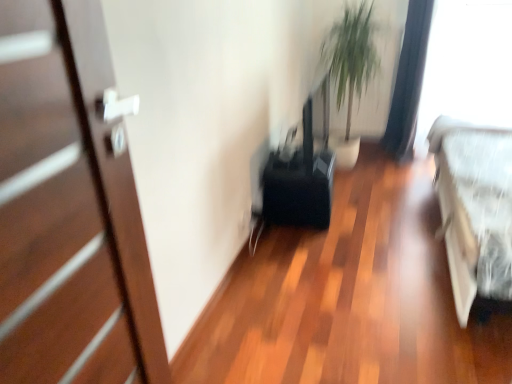
Question: Is white fabric bed at right aimed at transparent plastic window screen at upper right?

Choices:
 (A) no
 (B) yes

Answer: (A)

Question: Can you confirm if white fabric bed at right is thinner than transparent plastic window screen at upper right?

Choices:
 (A) yes
 (B) no

Answer: (B)

Question: Does white fabric bed at right have a lesser height compared to transparent plastic window screen at upper right?

Choices:
 (A) no
 (B) yes

Answer: (B)

Question: From the image's perspective, is white fabric bed at right above transparent plastic window screen at upper right?

Choices:
 (A) yes
 (B) no

Answer: (B)

Question: From a real-world perspective, is white fabric bed at right on transparent plastic window screen at upper right?

Choices:
 (A) no
 (B) yes

Answer: (A)

Question: Does white fabric bed at right have a smaller size compared to transparent plastic window screen at upper right?

Choices:
 (A) no
 (B) yes

Answer: (A)

Question: Considering the relative sizes of green leafy plant at upper center and white fabric bed at right in the image provided, is green leafy plant at upper center thinner than white fabric bed at right?

Choices:
 (A) no
 (B) yes

Answer: (B)

Question: Is green leafy plant at upper center positioned beyond the bounds of white fabric bed at right?

Choices:
 (A) no
 (B) yes

Answer: (B)

Question: Is green leafy plant at upper center to the left of white fabric bed at right from the viewer's perspective?

Choices:
 (A) no
 (B) yes

Answer: (B)

Question: Considering the relative sizes of green leafy plant at upper center and white fabric bed at right in the image provided, is green leafy plant at upper center taller than white fabric bed at right?

Choices:
 (A) no
 (B) yes

Answer: (B)

Question: Is green leafy plant at upper center wider than white fabric bed at right?

Choices:
 (A) no
 (B) yes

Answer: (A)

Question: Is green leafy plant at upper center facing towards white fabric bed at right?

Choices:
 (A) no
 (B) yes

Answer: (A)

Question: From the image's perspective, is black fabric curtain at upper right under green leafy plant at upper center?

Choices:
 (A) yes
 (B) no

Answer: (A)